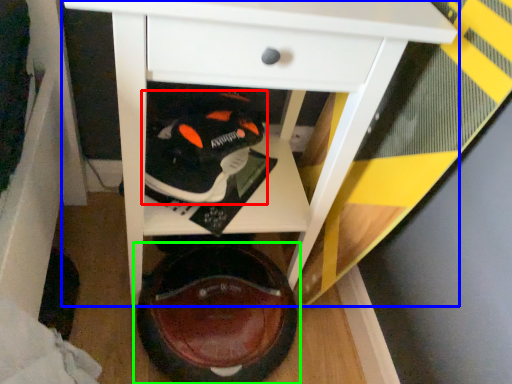
Question: Based on their relative distances, which object is farther from footwear (highlighted by a red box)? Choose from table (highlighted by a blue box) and footwear (highlighted by a green box).

Choices:
 (A) table
 (B) footwear

Answer: (B)